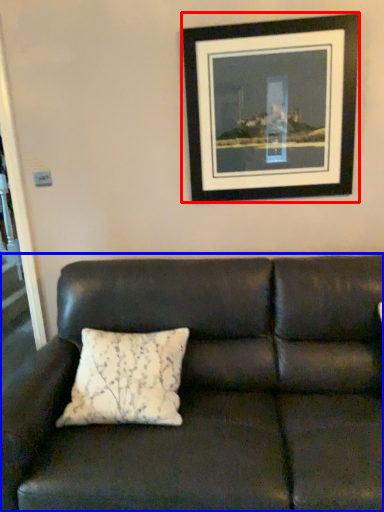
Question: Which of the following is the farthest to the observer, picture frame (highlighted by a red box) or studio couch (highlighted by a blue box)?

Choices:
 (A) picture frame
 (B) studio couch

Answer: (A)